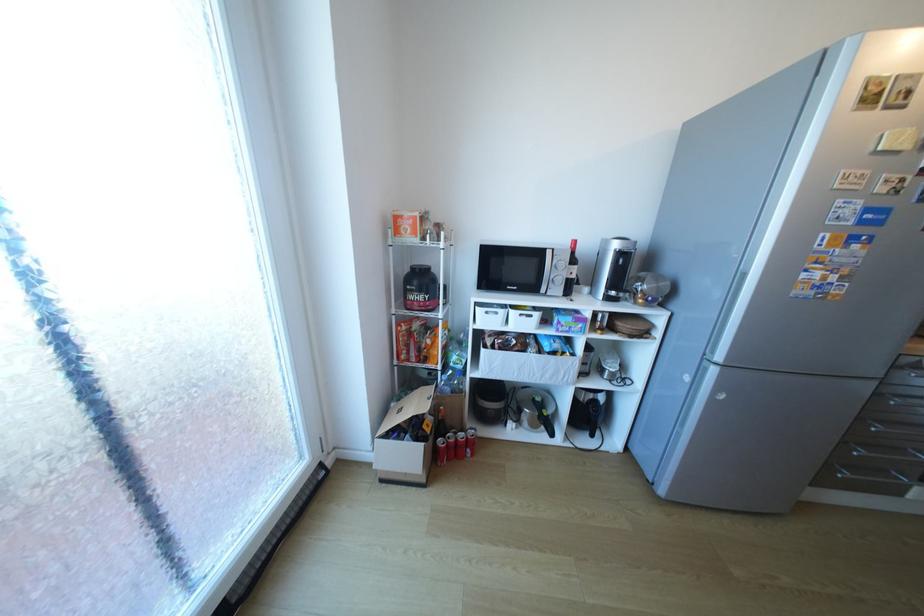
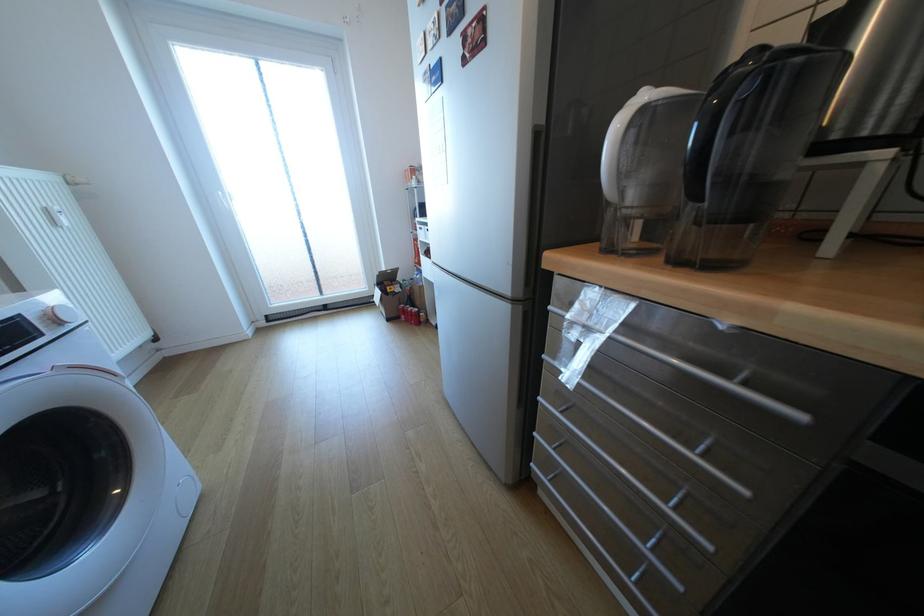
In the second image, find the point that corresponds to the point at 433,427 in the first image.

(397, 288)